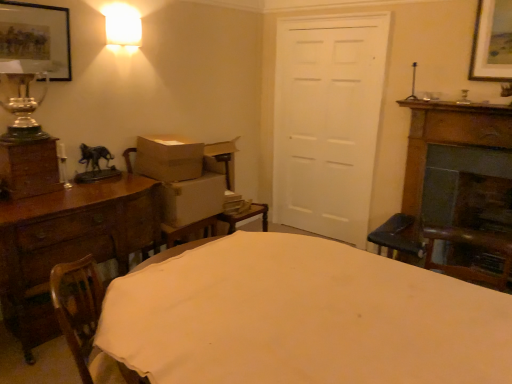
Question: Would you say white cardboard box at left, which appears as the 2th cardboard box when viewed from the top, is outside matte glass lampshade at upper left?

Choices:
 (A) no
 (B) yes

Answer: (B)

Question: Can you confirm if white cardboard box at left, which appears as the 2th cardboard box when viewed from the top, is shorter than matte glass lampshade at upper left?

Choices:
 (A) no
 (B) yes

Answer: (A)

Question: Is white cardboard box at left, which is the first cardboard box from bottom to top, closer to camera compared to matte glass lampshade at upper left?

Choices:
 (A) yes
 (B) no

Answer: (B)

Question: Considering the relative positions of white cardboard box at left, which appears as the 2th cardboard box when viewed from the top, and matte glass lampshade at upper left in the image provided, is white cardboard box at left, which appears as the 2th cardboard box when viewed from the top, behind matte glass lampshade at upper left?

Choices:
 (A) yes
 (B) no

Answer: (A)

Question: Considering the relative sizes of white cardboard box at left, which is the first cardboard box from bottom to top, and matte glass lampshade at upper left in the image provided, is white cardboard box at left, which is the first cardboard box from bottom to top, taller than matte glass lampshade at upper left?

Choices:
 (A) no
 (B) yes

Answer: (B)

Question: Is white cardboard box at left, which is the first cardboard box from bottom to top, beside matte glass lampshade at upper left?

Choices:
 (A) no
 (B) yes

Answer: (A)

Question: Does wooden chest of drawers at left appear on the left side of brown cardboard box at center, marked as the 2th cardboard box in a bottom-to-top arrangement?

Choices:
 (A) no
 (B) yes

Answer: (B)

Question: From the image's perspective, would you say wooden chest of drawers at left is positioned over brown cardboard box at center, marked as the 2th cardboard box in a bottom-to-top arrangement?

Choices:
 (A) yes
 (B) no

Answer: (B)

Question: From a real-world perspective, is wooden chest of drawers at left on top of brown cardboard box at center, marked as the 2th cardboard box in a bottom-to-top arrangement?

Choices:
 (A) yes
 (B) no

Answer: (B)

Question: Does wooden chest of drawers at left come behind brown cardboard box at center, the first cardboard box when ordered from top to bottom?

Choices:
 (A) no
 (B) yes

Answer: (A)

Question: Does wooden chest of drawers at left lie in front of brown cardboard box at center, the first cardboard box when ordered from top to bottom?

Choices:
 (A) no
 (B) yes

Answer: (B)

Question: Is wooden chest of drawers at left beside brown cardboard box at center, marked as the 2th cardboard box in a bottom-to-top arrangement?

Choices:
 (A) no
 (B) yes

Answer: (A)

Question: Can you confirm if wooden chest of drawers at left is wider than white cardboard box at left, which is the first cardboard box from bottom to top?

Choices:
 (A) no
 (B) yes

Answer: (B)